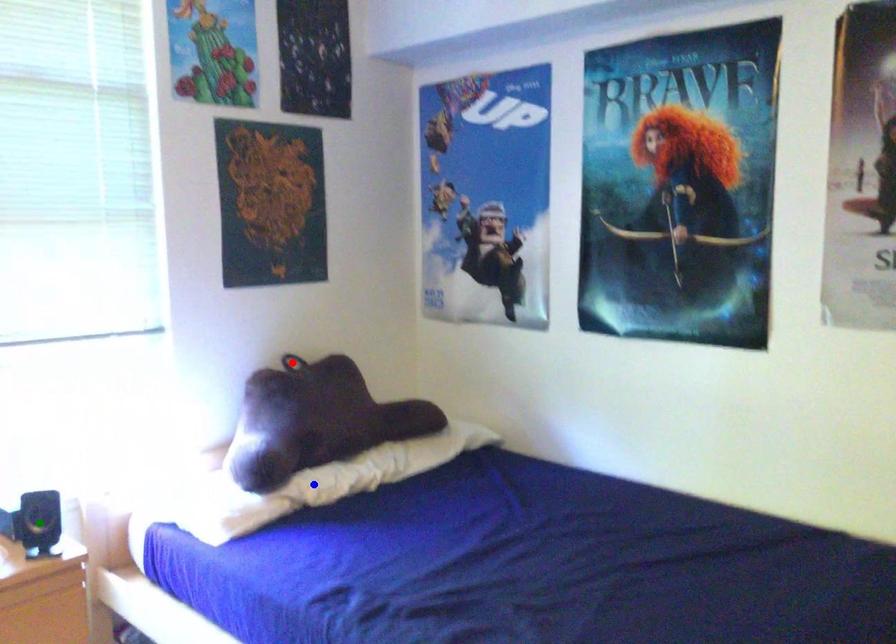
Order these from farthest to nearest:
blue point, green point, red point

red point < blue point < green point